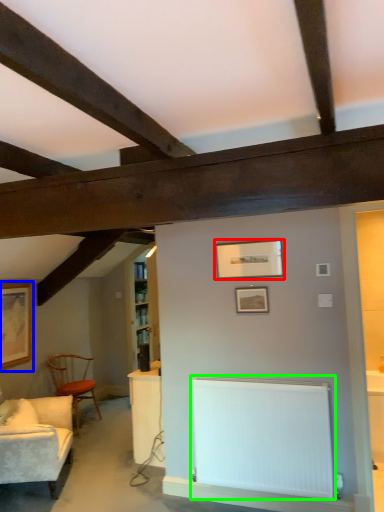
Question: Estimate the real-world distances between objects in this image. Which object is closer to picture frame (highlighted by a red box), picture frame (highlighted by a blue box) or radiator (highlighted by a green box)?

Choices:
 (A) picture frame
 (B) radiator

Answer: (B)